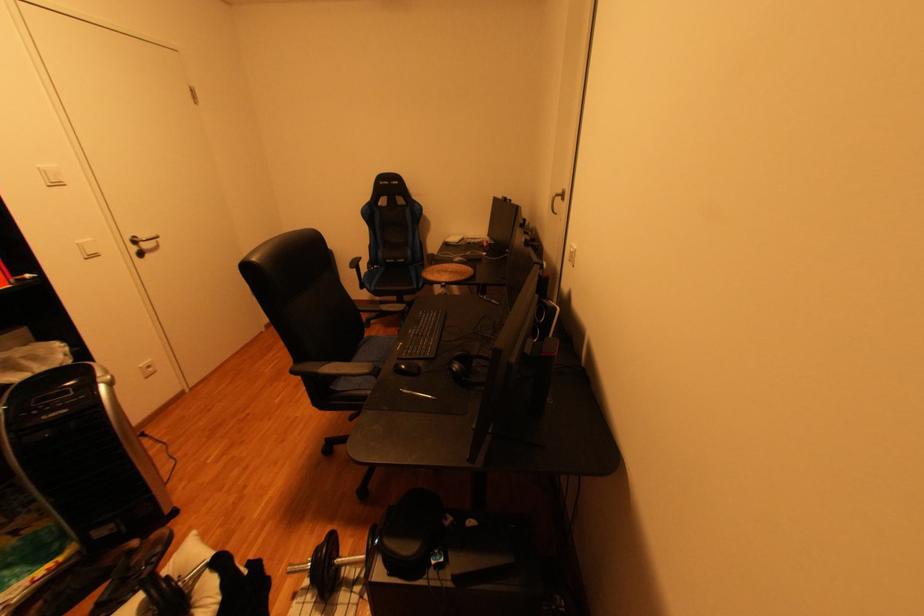
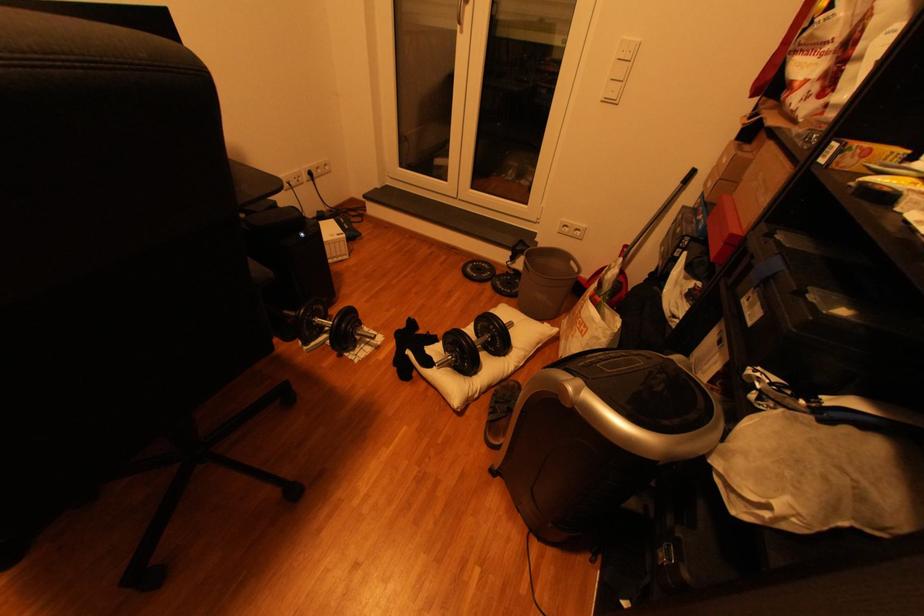
Locate, in the second image, the point that corresponds to point 215,573 in the first image.

(445, 361)